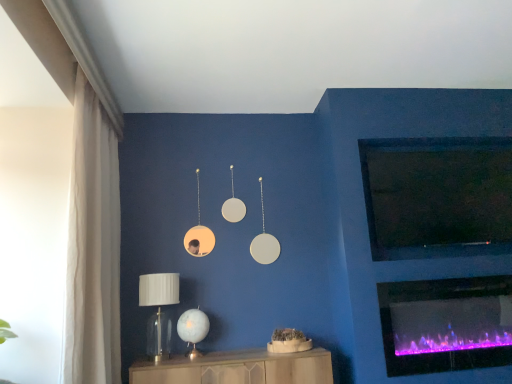
Question: In which direction should I rotate to look at translucent glass table lamp at lower center, the second table lamp from the left?

Choices:
 (A) left
 (B) right

Answer: (A)

Question: Considering the relative positions of clear glass table lamp at lower left, which is the first table lamp from left to right, and translucent glass table lamp at lower center, which appears as the 1th table lamp when viewed from the right, in the image provided, is clear glass table lamp at lower left, which is the first table lamp from left to right, to the right of translucent glass table lamp at lower center, which appears as the 1th table lamp when viewed from the right, from the viewer's perspective?

Choices:
 (A) no
 (B) yes

Answer: (A)

Question: From a real-world perspective, is clear glass table lamp at lower left, which is the first table lamp from left to right, located higher than translucent glass table lamp at lower center, the second table lamp from the left?

Choices:
 (A) yes
 (B) no

Answer: (A)

Question: From a real-world perspective, is clear glass table lamp at lower left, which is the first table lamp from left to right, physically below translucent glass table lamp at lower center, which appears as the 1th table lamp when viewed from the right?

Choices:
 (A) no
 (B) yes

Answer: (A)

Question: Is clear glass table lamp at lower left, which is counted as the 2th table lamp, starting from the right, wider than translucent glass table lamp at lower center, the second table lamp from the left?

Choices:
 (A) no
 (B) yes

Answer: (B)

Question: Would you consider clear glass table lamp at lower left, which is counted as the 2th table lamp, starting from the right, to be distant from translucent glass table lamp at lower center, the second table lamp from the left?

Choices:
 (A) yes
 (B) no

Answer: (B)

Question: Does clear glass table lamp at lower left, which is counted as the 2th table lamp, starting from the right, come in front of translucent glass table lamp at lower center, the second table lamp from the left?

Choices:
 (A) yes
 (B) no

Answer: (A)

Question: From a real-world perspective, is purple electric fireplace at lower right on white sheer curtain at left?

Choices:
 (A) no
 (B) yes

Answer: (A)

Question: Considering the relative positions of purple electric fireplace at lower right and white sheer curtain at left in the image provided, is purple electric fireplace at lower right behind white sheer curtain at left?

Choices:
 (A) yes
 (B) no

Answer: (A)

Question: Is purple electric fireplace at lower right next to white sheer curtain at left?

Choices:
 (A) yes
 (B) no

Answer: (B)

Question: Are purple electric fireplace at lower right and white sheer curtain at left located far from each other?

Choices:
 (A) no
 (B) yes

Answer: (B)

Question: Is purple electric fireplace at lower right not within white sheer curtain at left?

Choices:
 (A) yes
 (B) no

Answer: (A)

Question: Can you confirm if purple electric fireplace at lower right is thinner than white sheer curtain at left?

Choices:
 (A) no
 (B) yes

Answer: (B)

Question: Considering the relative sizes of purple electric fireplace at lower right and clear glass table lamp at lower left, which is the first table lamp from left to right, in the image provided, is purple electric fireplace at lower right bigger than clear glass table lamp at lower left, which is the first table lamp from left to right,?

Choices:
 (A) no
 (B) yes

Answer: (B)